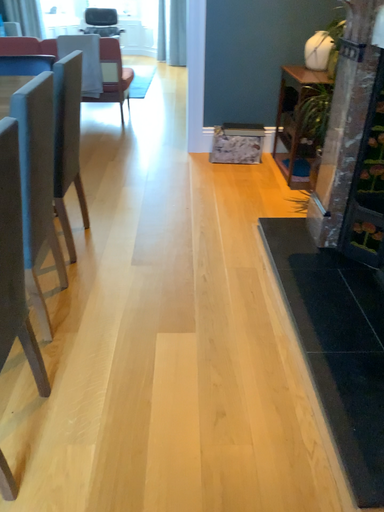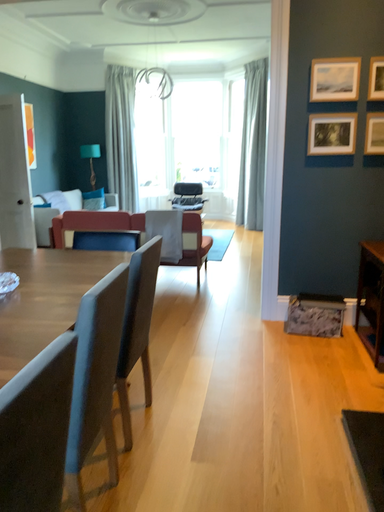
Question: How did the camera likely rotate when shooting the video?

Choices:
 (A) rotated downward
 (B) rotated upward

Answer: (B)